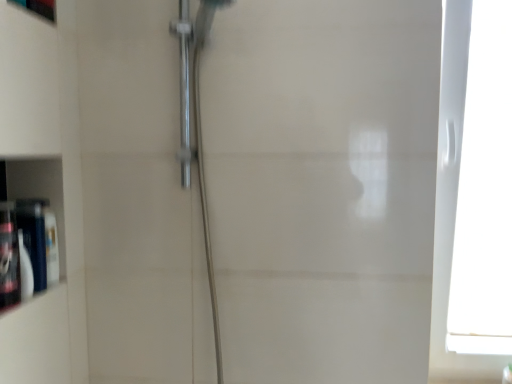
Question: Is translucent plastic bottle at left, acting as the 1th toiletry starting from the front, taller or shorter than matte black bottle at left, acting as the 2th toiletry starting from the front?

Choices:
 (A) short
 (B) tall

Answer: (B)

Question: In the image, is translucent plastic bottle at left, the second toiletry viewed from the back, on the left side or the right side of matte black bottle at left, the 1th toiletry when ordered from back to front?

Choices:
 (A) right
 (B) left

Answer: (B)

Question: Which of these objects is positioned closest to the translucent plastic bottle at left, the second toiletry viewed from the back?

Choices:
 (A) white plastic window at right
 (B) matte white cabinet at left
 (C) matte black bottle at left, acting as the 2th toiletry starting from the front

Answer: (C)

Question: Based on their relative distances, which object is farther from the matte black bottle at left, the 1th toiletry when ordered from back to front?

Choices:
 (A) matte white cabinet at left
 (B) translucent plastic bottle at left, acting as the 1th toiletry starting from the front
 (C) white plastic window at right

Answer: (C)